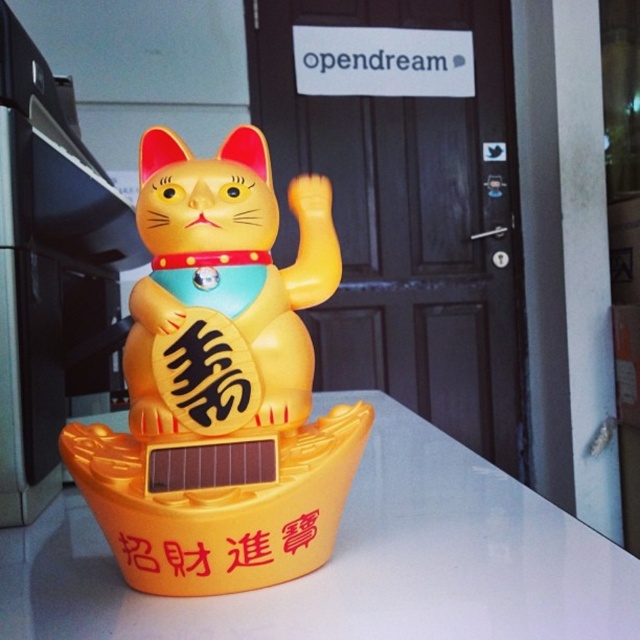
From the picture: You are a delivery person trying to place a small package on the yellow plastic counter top at center. The yellow matte plastic cat at center is already on the counter. Can you place the package next to the cat without moving it?

The yellow plastic counter top at center might be wider than yellow matte plastic cat at center, so there could be enough space to place the package next to the cat without moving it.

From the picture: You are standing in front of the door with a white sign and want to place a small object exactly halfway between point (42, 536) and point (252, 266). Which direction should you move from the closer point to reach the halfway point?

You should move towards the point (252, 266) from point (42, 536) because point (42, 536) is closer to you and the halfway point lies in the direction of the farther point (252, 266).

You are a delivery person who just arrived at the door with a package for the yellow plastic cat at center and yellow matte plastic cat at center. The package can only be delivered to the taller one. Which cat should you give the package to?

The yellow plastic cat at center is much taller than the yellow matte plastic cat at center, so you should give the package to the yellow plastic cat at center.